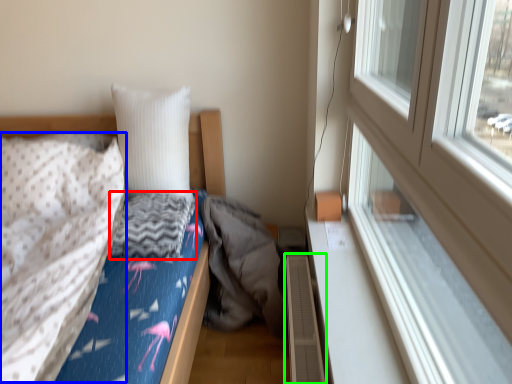
Question: Considering the real-world distances, which object is farthest from material (highlighted by a red box)? blanket (highlighted by a blue box) or radiator (highlighted by a green box)?

Choices:
 (A) blanket
 (B) radiator

Answer: (B)